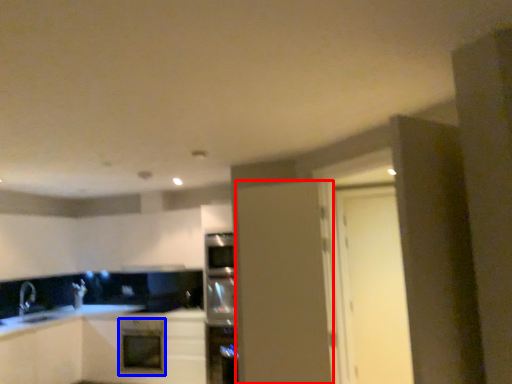
Question: Among these objects, which one is nearest to the camera, door (highlighted by a red box) or oven (highlighted by a blue box)?

Choices:
 (A) door
 (B) oven

Answer: (A)